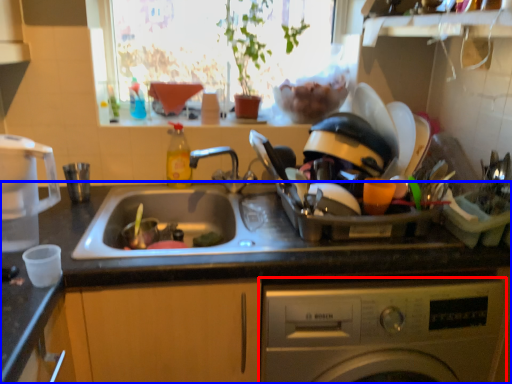
Question: Which object appears closest to the camera in this image, washing machine (highlighted by a red box) or countertop (highlighted by a blue box)?

Choices:
 (A) washing machine
 (B) countertop

Answer: (A)